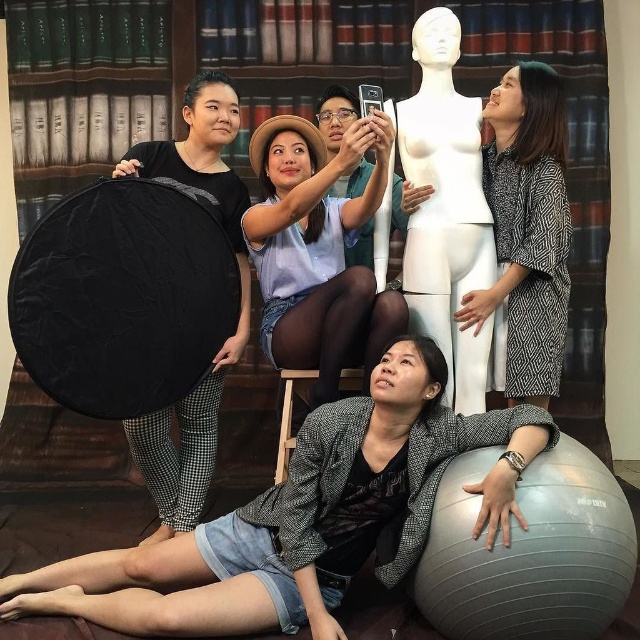
Question: Which object is the closest to the matte blue shirt at upper center?

Choices:
 (A) gray textured blazer at lower center
 (B) white matte mannequin at center

Answer: (B)

Question: Which point is closer to the camera taking this photo?

Choices:
 (A) (314, 486)
 (B) (500, 200)
 (C) (440, 200)
 (D) (262, 202)

Answer: (A)

Question: Does matte blue shirt at upper center appear on the left side of patterned fabric kimono at right?

Choices:
 (A) yes
 (B) no

Answer: (A)

Question: Which is farther from the patterned fabric kimono at right?

Choices:
 (A) matte blue shirt at upper center
 (B) gray textured blazer at lower center
 (C) white matte mannequin at center

Answer: (B)

Question: Does gray textured blazer at lower center appear under white matte mannequin at center?

Choices:
 (A) yes
 (B) no

Answer: (A)

Question: Can you confirm if gray textured blazer at lower center is smaller than white matte mannequin at center?

Choices:
 (A) no
 (B) yes

Answer: (A)